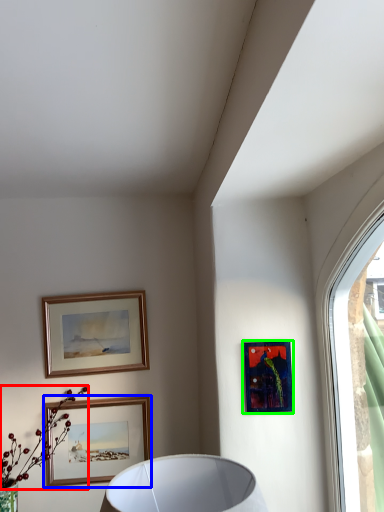
Question: Estimate the real-world distances between objects in this image. Which object is closer to flower (highlighted by a red box), picture frame (highlighted by a blue box) or picture frame (highlighted by a green box)?

Choices:
 (A) picture frame
 (B) picture frame

Answer: (A)